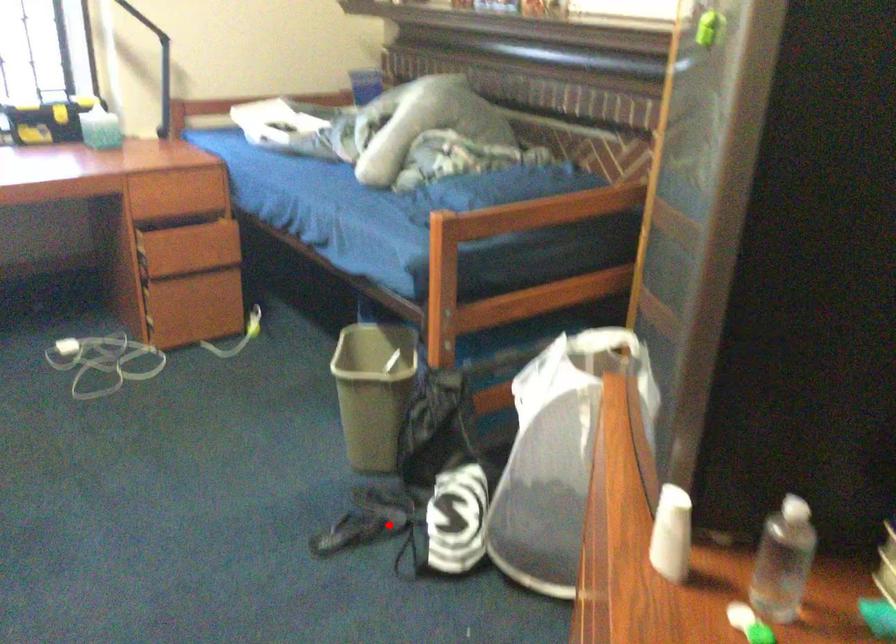
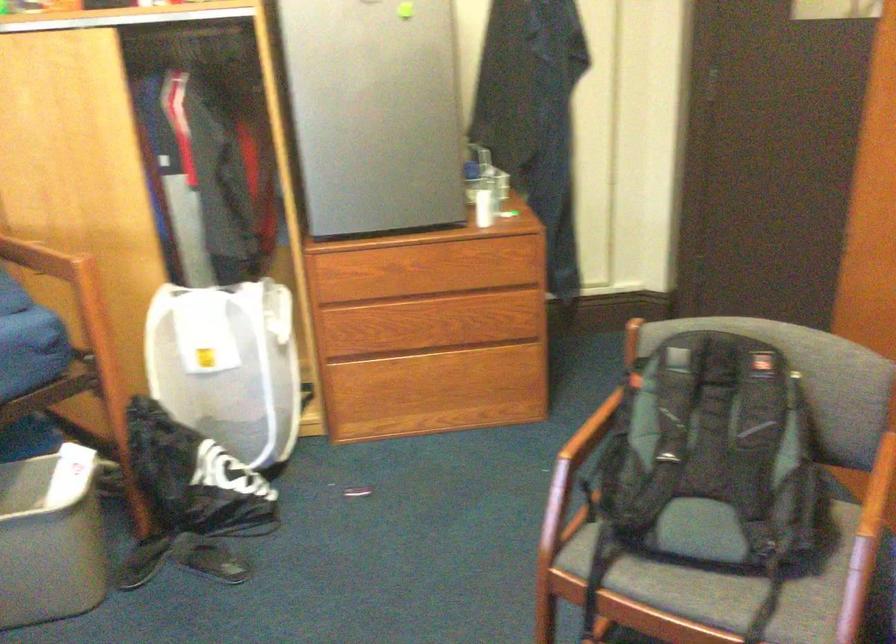
Locate, in the second image, the point that corresponds to the highlighted location in the first image.

(211, 559)